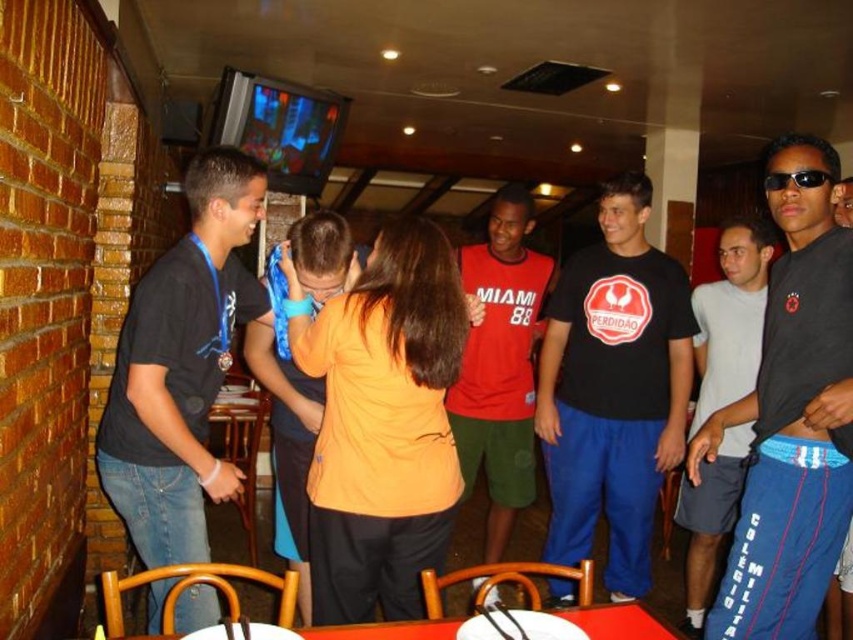
Question: Which of the following is the farthest from the observer?

Choices:
 (A) (610, 224)
 (B) (827, 525)

Answer: (A)

Question: Which point is farther from the camera taking this photo?

Choices:
 (A) (448, 620)
 (B) (379, 365)
 (C) (747, 291)

Answer: (C)

Question: Can you confirm if orange matte shirt at center is smaller than smooth plastic table at center?

Choices:
 (A) no
 (B) yes

Answer: (A)

Question: Does dark gray sweatpants at center appear on the left side of red matte shirt at center?

Choices:
 (A) yes
 (B) no

Answer: (B)

Question: Which of the following is the farthest from the observer?

Choices:
 (A) (570, 598)
 (B) (608, 621)
 (C) (483, 246)
 (D) (750, 492)

Answer: (C)

Question: Does white cotton shirt at center appear over smooth plastic table at center?

Choices:
 (A) yes
 (B) no

Answer: (A)